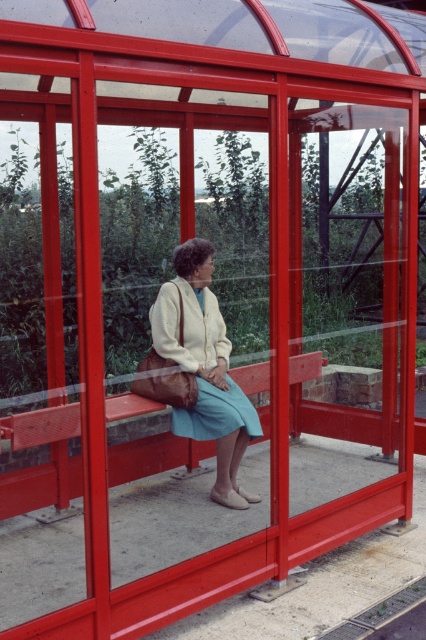
What do you see at coordinates (204, 369) in the screenshot?
I see `matte cream sweater at center` at bounding box center [204, 369].

Between matte cream sweater at center and wooden bench at center, which one is positioned lower?

wooden bench at center is lower down.

Does point (169, 324) lie behind point (123, 461)?

No.

The width and height of the screenshot is (426, 640). In order to click on matte cream sweater at center in this screenshot , I will do `click(204, 369)`.